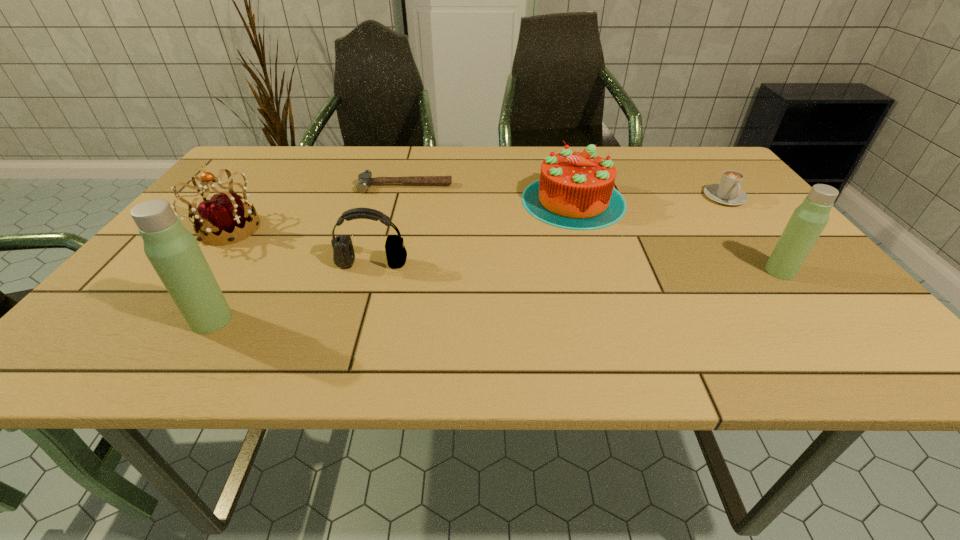
This screenshot has height=540, width=960. What are the coordinates of `vacant region located on the left of the right thermos bottle` in the screenshot? It's located at (631, 271).

Find the location of `blank space located 0.130m to the right of the sixth tallest object`. blank space located 0.130m to the right of the sixth tallest object is located at coordinates (757, 238).

I want to click on free space located on the striking face of the hammer, so click(x=396, y=223).

Locate an element on the screen. This screenshot has height=540, width=960. free space located 0.140m on the back of the fifth object from left to right is located at coordinates (560, 154).

Where is `free space located on the front-facing side of the tiara`? free space located on the front-facing side of the tiara is located at coordinates (415, 229).

The image size is (960, 540). I want to click on vacant area situated on the headband of the headset, so click(x=363, y=296).

The width and height of the screenshot is (960, 540). I want to click on hammer that is at the far edge, so click(x=365, y=179).

Image resolution: width=960 pixels, height=540 pixels. What are the coordinates of `cake present at the far edge` in the screenshot? It's located at (575, 190).

The height and width of the screenshot is (540, 960). I want to click on object that is at the near edge, so click(173, 251).

You are a GUI agent. You are given a task and a screenshot of the screen. Output one action in this format:
    pyautogui.click(x=<x>, y=<y>)
    Task: Click on the object located in the left edge section of the desktop
    This screenshot has width=960, height=540.
    Given the screenshot: What is the action you would take?
    pyautogui.click(x=226, y=219)